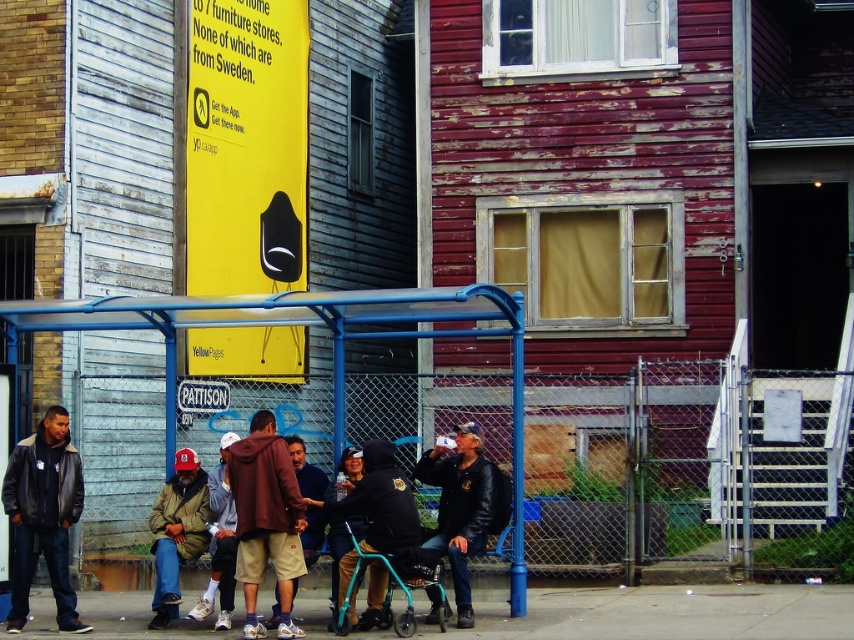
Question: Which of these objects is positioned closest to the leather jacket at left?

Choices:
 (A) denim jacket at lower left
 (B) leather jacket at center

Answer: (A)

Question: Observing the image, what is the correct spatial positioning of blue metal bus stop at center in reference to teal plastic walker at center?

Choices:
 (A) right
 (B) left

Answer: (B)

Question: Which point is farther from the camera taking this photo?

Choices:
 (A) (314, 314)
 (B) (290, 440)
 (C) (188, 484)

Answer: (C)

Question: Is maroon hoodie at center positioned before brown suede jacket at center?

Choices:
 (A) no
 (B) yes

Answer: (B)

Question: Is denim jacket at lower left positioned before brown suede jacket at center?

Choices:
 (A) no
 (B) yes

Answer: (B)

Question: Estimate the real-world distances between objects in this image. Which object is closer to the blue metal bus stop at center?

Choices:
 (A) leather jacket at center
 (B) brown suede jacket at center

Answer: (A)